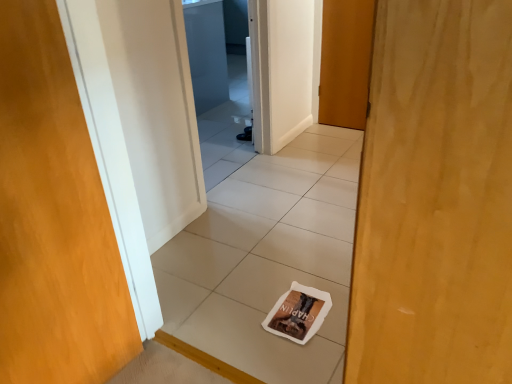
Find the location of a particular element. free space above brown paper magazine at center (from a real-world perspective) is located at coordinates (296, 306).